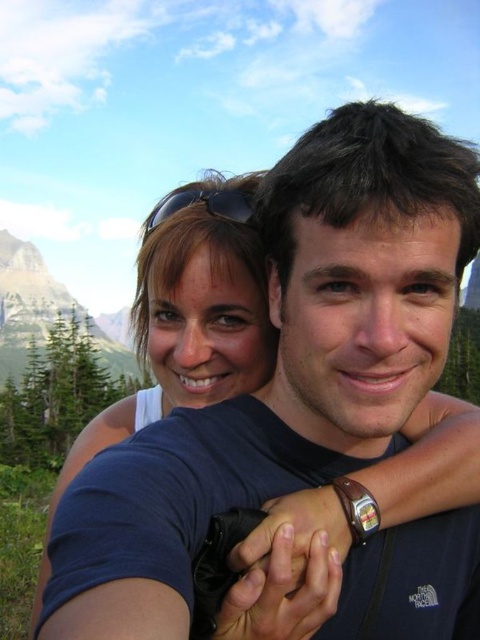
Does matte white shirt at upper center come in front of black matte sunglasses at upper center?

Yes, it is in front of black matte sunglasses at upper center.

Between matte white shirt at upper center and black matte sunglasses at upper center, which one is positioned higher?

black matte sunglasses at upper center

Does point (146, 241) come closer to viewer compared to point (211, 189)?

Yes, it is.

Locate an element on the screen. matte white shirt at upper center is located at coordinates (191, 314).

In the scene shown: Between matte white shirt at upper center and green forested mountain at upper left, which one has less height?

matte white shirt at upper center

Image resolution: width=480 pixels, height=640 pixels. What are the coordinates of `matte white shirt at upper center` in the screenshot? It's located at (191, 314).

Which is more to the left, green forested mountain at upper left or black matte sunglasses at upper center?

green forested mountain at upper left

Looking at this image, can you confirm if green forested mountain at upper left is shorter than black matte sunglasses at upper center?

In fact, green forested mountain at upper left may be taller than black matte sunglasses at upper center.

Identify the location of green forested mountain at upper left. This screenshot has height=640, width=480. (41, 310).